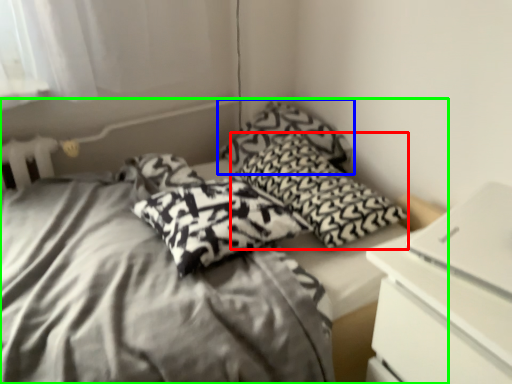
Question: Estimate the real-world distances between objects in this image. Which object is farther from pillow (highlighted by a red box), pillow (highlighted by a blue box) or bed (highlighted by a green box)?

Choices:
 (A) pillow
 (B) bed

Answer: (B)